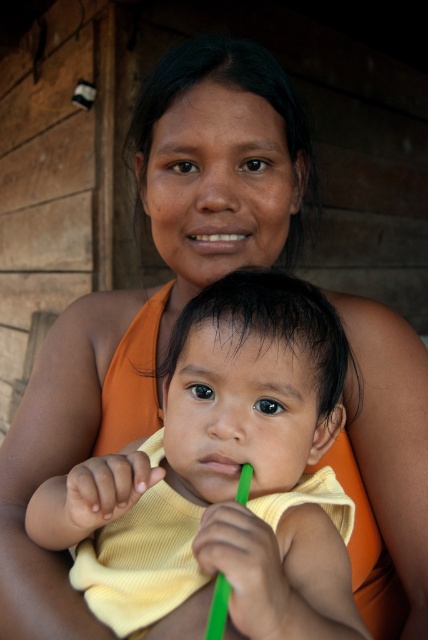
From the picture: Looking at the scene described, where is the matte skin at center in relation to the green plastic toothbrush at lower center?

The matte skin at center is to the left of the green plastic toothbrush at lower center.

You are a photographer adjusting lighting for a portrait. You notice the matte skin at center and the green plastic toothbrush at lower center. Which object is closer to the camera?

The matte skin at center is taller than the green plastic toothbrush at lower center, which indicates it is closer to the camera.